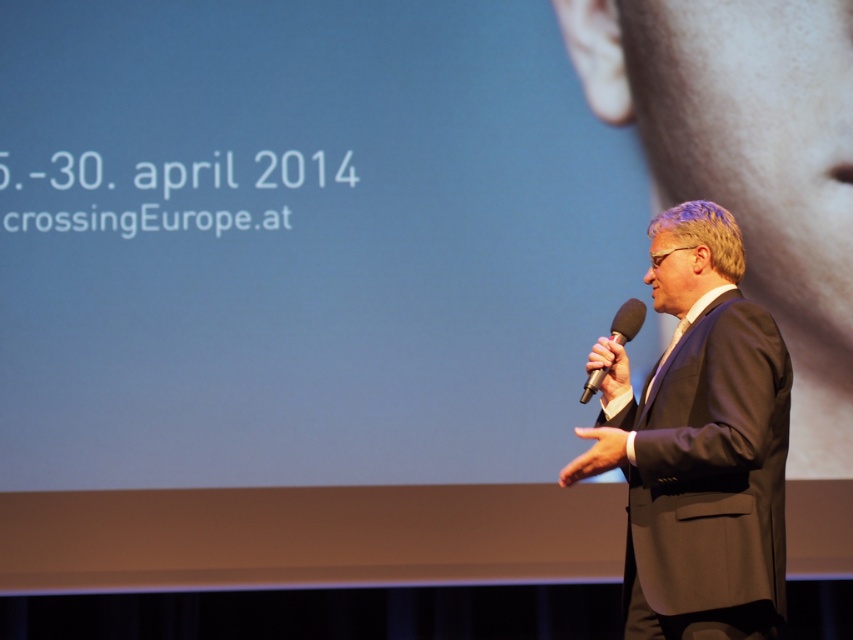
In the scene shown: Does matte black suit at right have a larger size compared to black matte microphone at right?

Yes, matte black suit at right is bigger than black matte microphone at right.

Where is `matte black suit at right`? The height and width of the screenshot is (640, 853). matte black suit at right is located at coordinates (699, 444).